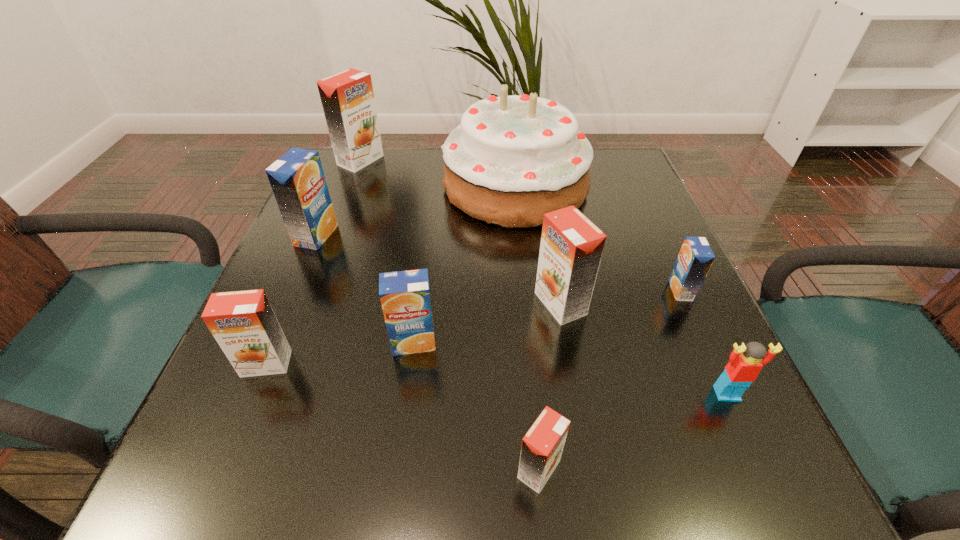
Where is `cake`? Image resolution: width=960 pixels, height=540 pixels. cake is located at coordinates (512, 159).

At what (x,y) coordinates should I click in order to perform the action: click on the farthest orange orange juice. Please return your answer as a coordinate pair (x, y). The width and height of the screenshot is (960, 540). Looking at the image, I should click on (347, 98).

Where is `the tallest orange juice`? Image resolution: width=960 pixels, height=540 pixels. the tallest orange juice is located at coordinates (347, 98).

Identify the location of the farthest blue orange_juice. Image resolution: width=960 pixels, height=540 pixels. click(297, 179).

Find the location of a particular element. the biggest blue orange_juice is located at coordinates (297, 179).

The width and height of the screenshot is (960, 540). I want to click on the second farthest orange orange juice, so click(x=571, y=248).

Identify the location of the second nearest orange orange juice. (243, 323).

Find the location of `the second smallest blue orange_juice`. the second smallest blue orange_juice is located at coordinates (405, 295).

The height and width of the screenshot is (540, 960). Find the location of `the second blue orange_juice from right to left`. the second blue orange_juice from right to left is located at coordinates point(405,295).

Locate an element on the screen. Image resolution: width=960 pixels, height=540 pixels. the second nearest object is located at coordinates (742, 370).